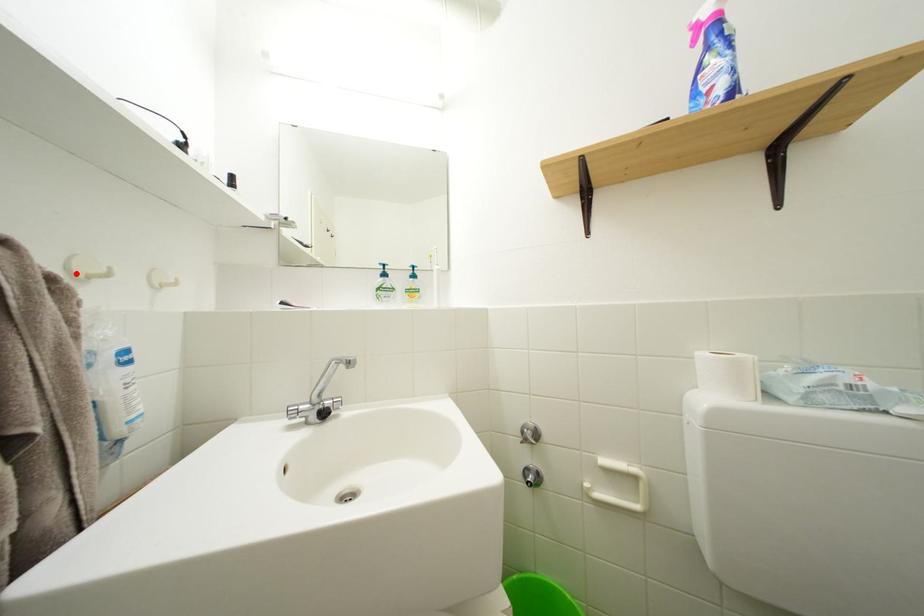
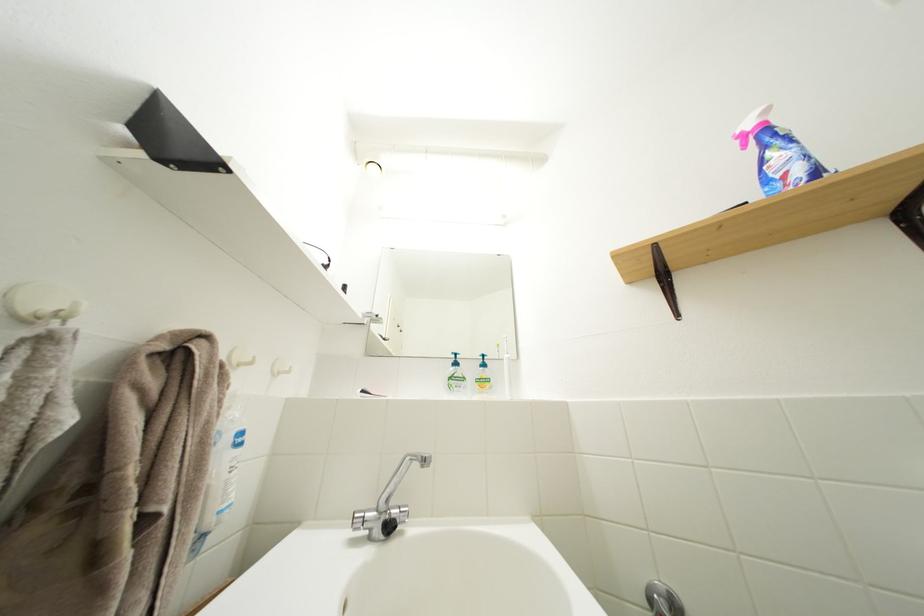
The point at the highlighted location is marked in the first image. Where is the corresponding point in the second image?

(238, 363)